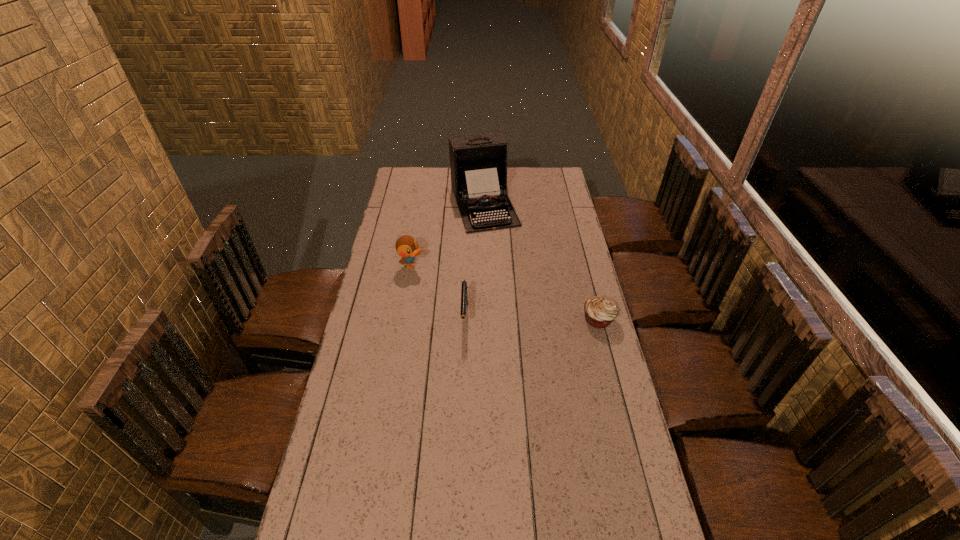
The image size is (960, 540). I want to click on pistol, so pos(464,297).

This screenshot has height=540, width=960. Identify the location of the rightmost object. (600, 311).

You are a GUI agent. You are given a task and a screenshot of the screen. Output one action in this format:
    pyautogui.click(x=<x>, y=<y>)
    Task: Click on the muffin
    This screenshot has width=960, height=540.
    Given the screenshot: What is the action you would take?
    pyautogui.click(x=600, y=311)

Image resolution: width=960 pixels, height=540 pixels. I want to click on the second tallest object, so click(x=406, y=246).

You are a GUI agent. You are given a task and a screenshot of the screen. Output one action in this format:
    pyautogui.click(x=<x>, y=<y>)
    Task: Click on the leftmost object
    The image size is (960, 540).
    Given the screenshot: What is the action you would take?
    pyautogui.click(x=406, y=246)

In order to click on the tallest object in this screenshot , I will do `click(478, 163)`.

Locate an element on the screen. This screenshot has height=540, width=960. the farthest object is located at coordinates (478, 163).

You are a GUI agent. You are given a task and a screenshot of the screen. Output one action in this format:
    pyautogui.click(x=<x>, y=<y>)
    Task: Click on the vacant space situated at the muzzle of the pistol
    The height and width of the screenshot is (540, 960).
    Given the screenshot: What is the action you would take?
    pyautogui.click(x=462, y=411)

At what (x,y) coordinates should I click in order to perform the action: click on free location located 0.240m on the left of the shortest object. Please return your answer as a coordinate pair (x, y). This screenshot has height=540, width=960. Looking at the image, I should click on (518, 319).

Find the location of a particular element. vacant area situated 0.400m on the front-facing side of the leftmost object is located at coordinates (501, 309).